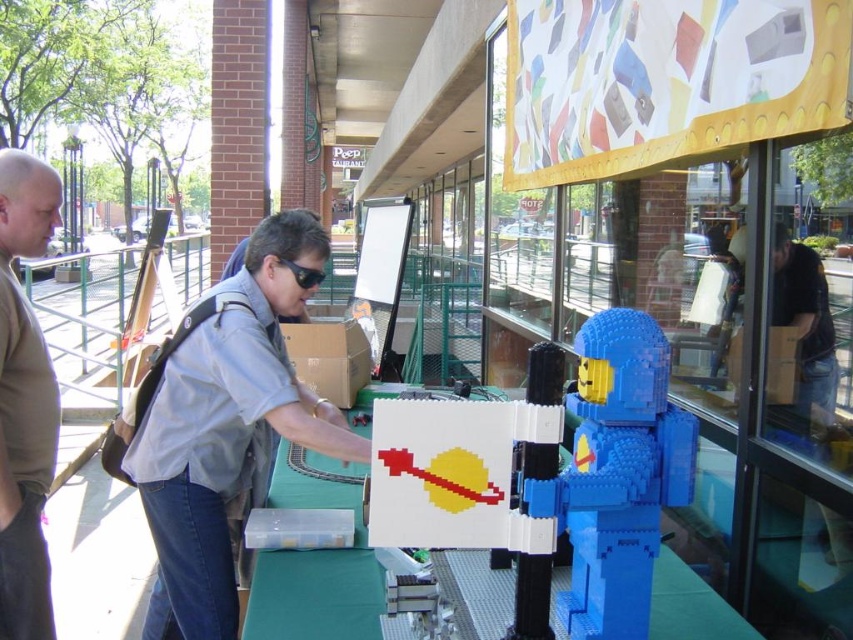
Question: Considering the real-world distances, which object is closest to the brown cardboard box at center?

Choices:
 (A) blue plastic toy at center
 (B) light blue shirt at center
 (C) black plastic goggles at center
 (D) matte khaki shirt at left

Answer: (B)

Question: Can you confirm if brown cardboard box at center is positioned below black plastic goggles at center?

Choices:
 (A) yes
 (B) no

Answer: (A)

Question: Which object appears closest to the camera in this image?

Choices:
 (A) black plastic goggles at center
 (B) cardboard box at upper right
 (C) matte khaki shirt at left
 (D) brown cardboard box at center

Answer: (C)

Question: Considering the relative positions of matte khaki shirt at left and cardboard box at upper right in the image provided, where is matte khaki shirt at left located with respect to cardboard box at upper right?

Choices:
 (A) left
 (B) right

Answer: (A)

Question: Which object is closer to the camera taking this photo?

Choices:
 (A) black plastic goggles at center
 (B) matte khaki shirt at left
 (C) blue plastic toy at center

Answer: (C)

Question: Is the position of brown cardboard box at center less distant than that of cardboard box at upper right?

Choices:
 (A) yes
 (B) no

Answer: (B)